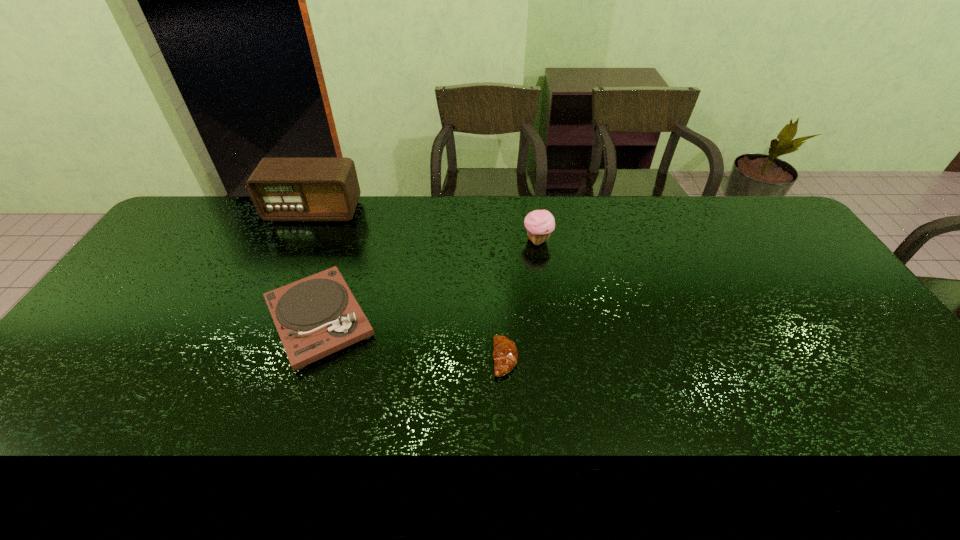
The height and width of the screenshot is (540, 960). Find the location of `the farthest object`. the farthest object is located at coordinates (282, 189).

Identify the location of radio receiver. The image size is (960, 540). (282, 189).

Identify the location of cupcake. (540, 223).

Find the location of a particular element. The image size is (960, 540). the rightmost object is located at coordinates (540, 223).

The height and width of the screenshot is (540, 960). In order to click on phonograph_record in this screenshot , I will do pyautogui.click(x=316, y=316).

I want to click on the second object from right to left, so click(505, 354).

This screenshot has height=540, width=960. I want to click on the shortest object, so click(505, 354).

Identify the location of vacant space situated on the front-facing side of the radio receiver. 302,237.

You are a GUI agent. You are given a task and a screenshot of the screen. Output one action in this format:
    pyautogui.click(x=<x>, y=<y>)
    Task: Click on the vacant space located on the left of the third shortest object
    
    Given the screenshot: What is the action you would take?
    pyautogui.click(x=481, y=240)

Where is `vacant area situated on the back of the third tallest object`? This screenshot has height=540, width=960. vacant area situated on the back of the third tallest object is located at coordinates (353, 215).